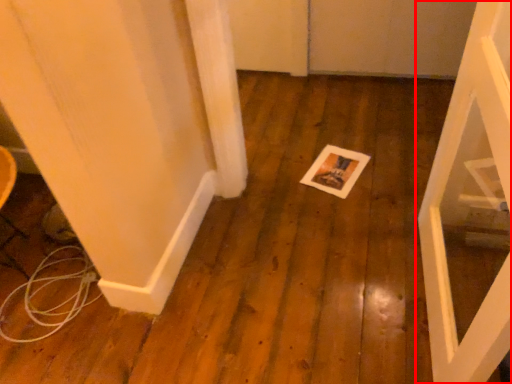
Question: From the image, what is the correct spatial relationship of door (annotated by the red box) in relation to postcard?

Choices:
 (A) left
 (B) right

Answer: (B)